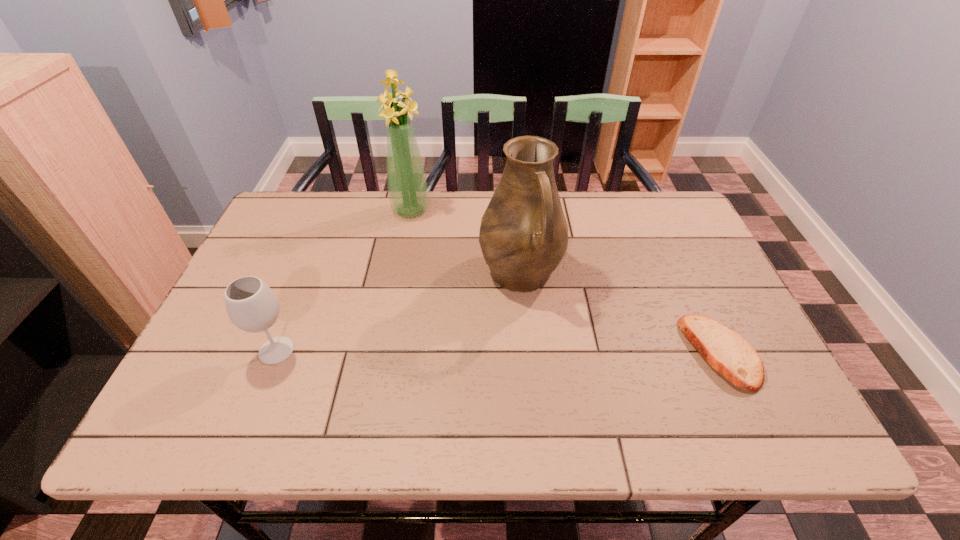
Where is `free point located 0.290m on the front-facing side of the third object from right to left`? The width and height of the screenshot is (960, 540). free point located 0.290m on the front-facing side of the third object from right to left is located at coordinates (428, 290).

The height and width of the screenshot is (540, 960). Find the location of `vacant space located 0.280m on the front-facing side of the third object from right to left`. vacant space located 0.280m on the front-facing side of the third object from right to left is located at coordinates (428, 287).

Find the location of a particular element. free location located on the front-facing side of the third object from right to left is located at coordinates 429,293.

Locate an element on the screen. vacant area situated 0.210m on the handle side of the second object from right to left is located at coordinates (568, 381).

Image resolution: width=960 pixels, height=540 pixels. Find the location of `free space located 0.110m on the handle side of the second object from right to left`. free space located 0.110m on the handle side of the second object from right to left is located at coordinates (551, 345).

Identify the location of vacant area situated on the handle side of the second object from right to left. (556, 355).

The image size is (960, 540). In order to click on object located at the far edge in this screenshot , I will do `click(408, 192)`.

The height and width of the screenshot is (540, 960). Find the location of `wineglass that is at the near edge`. wineglass that is at the near edge is located at coordinates (252, 306).

Where is `pita bread that is positioned at the near edge`? pita bread that is positioned at the near edge is located at coordinates (726, 351).

This screenshot has height=540, width=960. I want to click on object located at the left edge, so click(x=252, y=306).